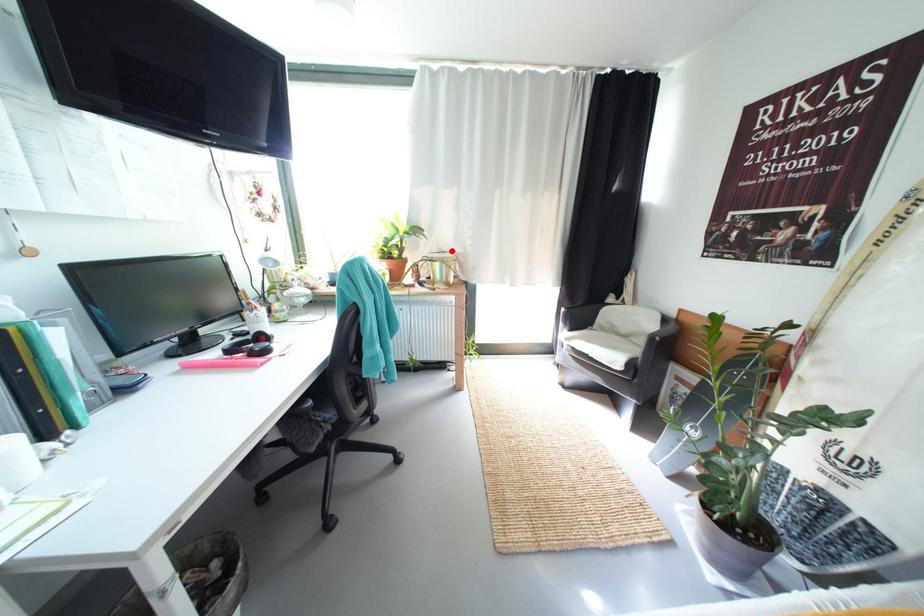
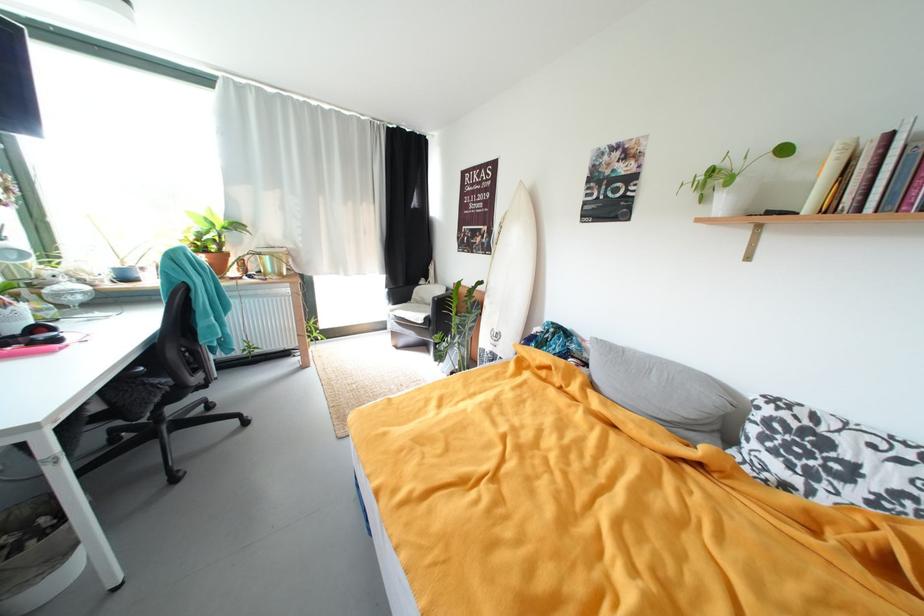
Where in the second image is the point corresponding to the highlighted location from the first image?

(281, 246)